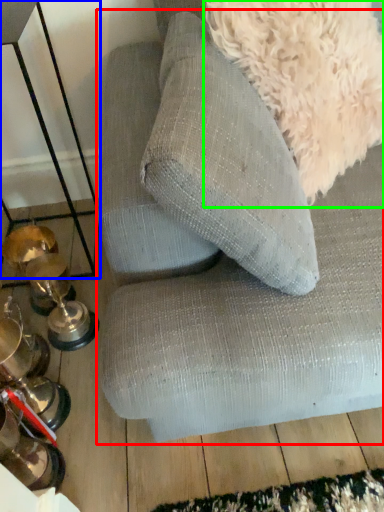
Question: Which object is the closest to the studio couch (highlighted by a red box)? Choose among these: table (highlighted by a blue box) or dog (highlighted by a green box).

Choices:
 (A) table
 (B) dog

Answer: (B)